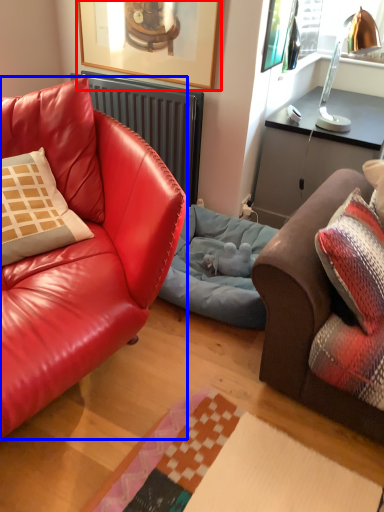
Question: Among these objects, which one is farthest to the camera, picture frame (highlighted by a red box) or studio couch (highlighted by a blue box)?

Choices:
 (A) picture frame
 (B) studio couch

Answer: (A)